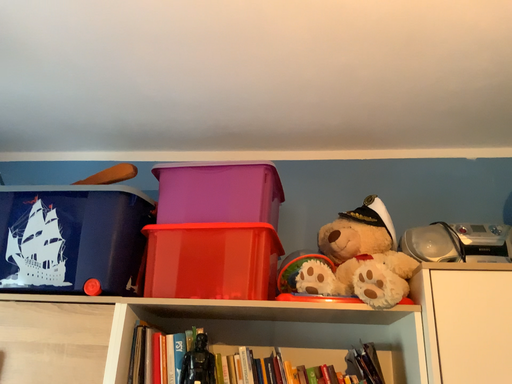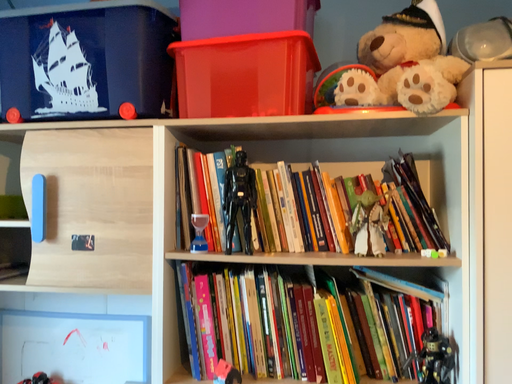
Question: Which way did the camera rotate in the video?

Choices:
 (A) rotated upward
 (B) rotated downward

Answer: (B)